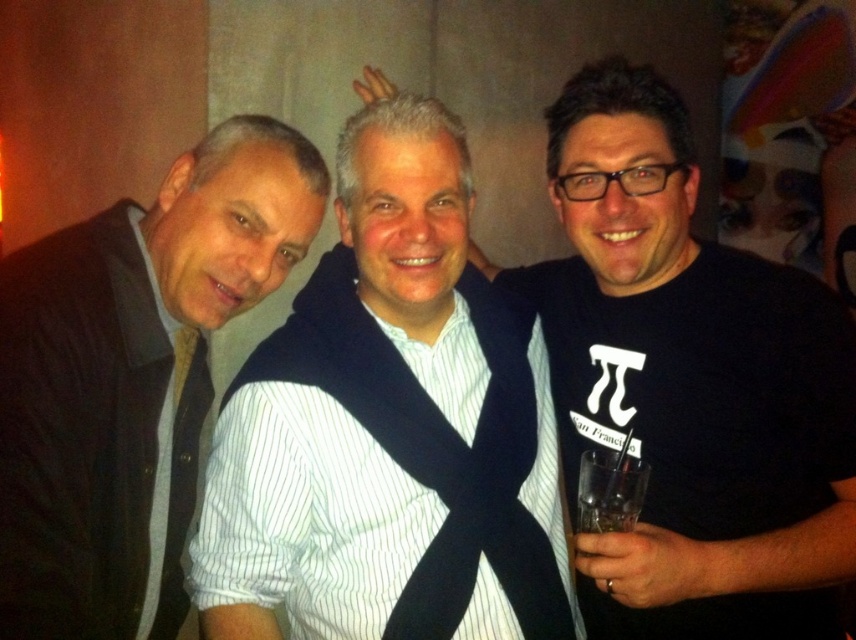
You are a photographer at a social event and need to adjust the camera focus. The subjects are the man in the dark blazer on the left and the man in the white striped shirt at center. How far apart are these two individuals?

The man in the dark blazer on the left and the man in the white striped shirt at center are 3.70 feet apart.

You are standing in front of a group photo of three people. You need to identify the position of the white striped shirt at center and the matte black jacket at left. Which one is more to the left?

The matte black jacket at left is more to the left than the white striped shirt at center.